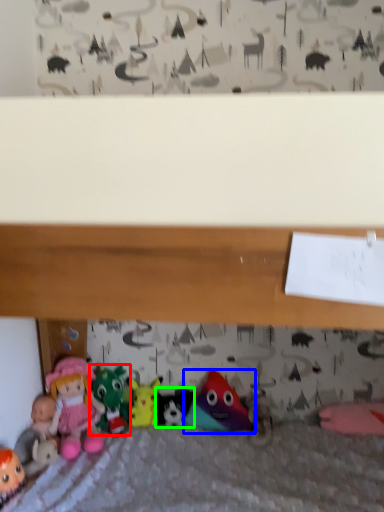
Question: Estimate the real-world distances between objects in this image. Which object is closer to toy (highlighted by a red box), toy (highlighted by a blue box) or toy (highlighted by a green box)?

Choices:
 (A) toy
 (B) toy

Answer: (B)